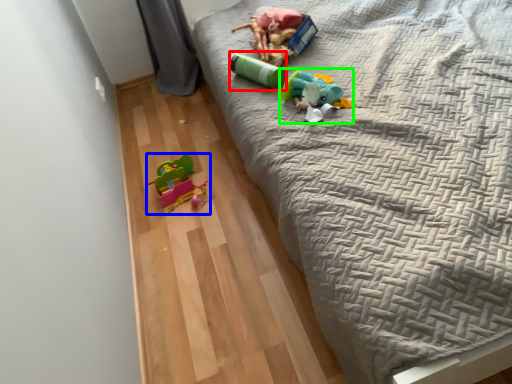
Question: Which is farther away from toy (highlighted by a red box)? toy (highlighted by a blue box) or toy (highlighted by a green box)?

Choices:
 (A) toy
 (B) toy

Answer: (A)